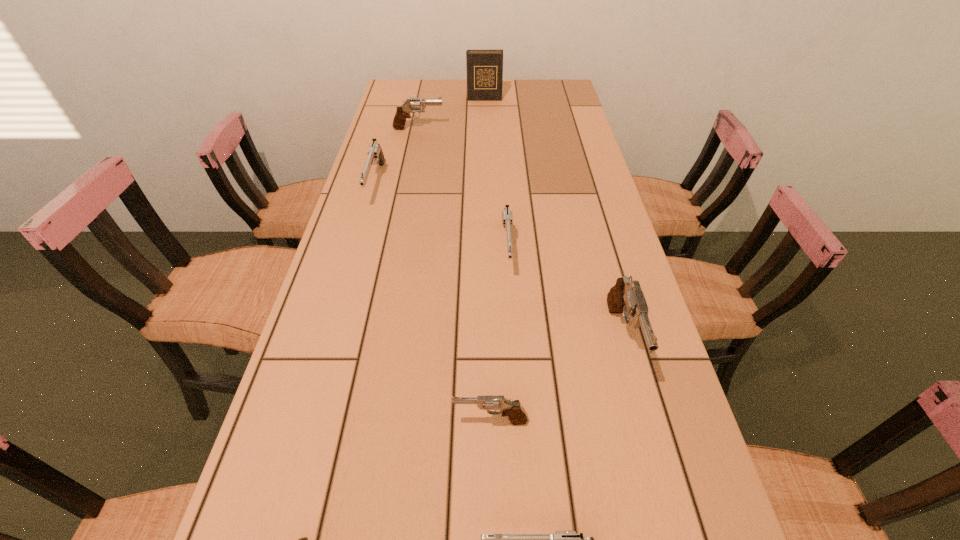
Locate an element on the screen. The image size is (960, 540). the tallest object is located at coordinates (484, 68).

Where is `diary`? This screenshot has height=540, width=960. diary is located at coordinates (484, 68).

Where is `the seventh shortest object`? This screenshot has height=540, width=960. the seventh shortest object is located at coordinates pos(626,297).

Identify the location of the rightmost pistol. The image size is (960, 540). (626, 297).

Find the location of a particular element. Image resolution: width=960 pixels, height=540 pixels. the second biggest gray pistol is located at coordinates (411, 105).

Where is `the seventh nearest object`? This screenshot has width=960, height=540. the seventh nearest object is located at coordinates (411, 105).

Identify the location of the third farthest object. point(375,155).

At what (x,y) coordinates should I click in order to perform the action: click on the leftmost silver pistol. Please return your answer as a coordinate pair (x, y). Looking at the image, I should click on (375, 155).

What are the coordinates of `the third farthest pistol` in the screenshot? It's located at (507, 218).

The height and width of the screenshot is (540, 960). I want to click on the third smallest silver pistol, so click(507, 218).